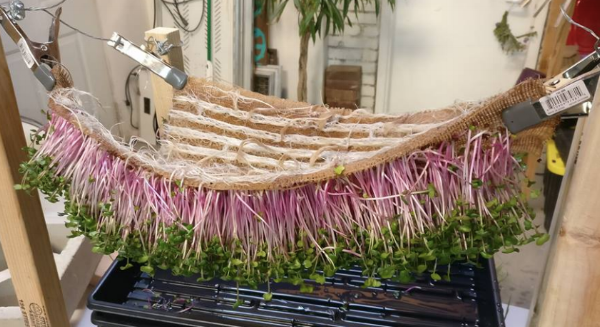
I want to click on black tray, so click(114, 291).